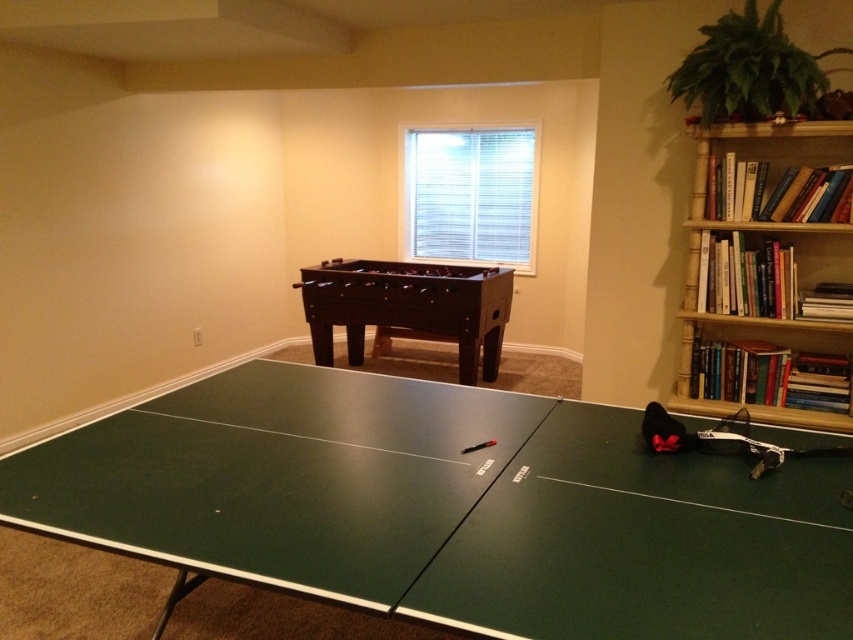
You are organizing a game night and need to move the green matte ping pong table at center closer to the entrance. However, the dark brown wooden foosball table at center is in the way. Can you move the ping pong table to the left without moving the foosball table?

The green matte ping pong table at center is positioned on the right side of the dark brown wooden foosball table at center. Therefore, moving it to the left would require moving it towards the foosball table, which is already blocking that direction. This makes it impossible to move the ping pong table to the left without moving the foosball table.

From the picture: You are organizing a game night and need to move a 7.5 feet long banner between the green matte ping pong table at center and the dark brown wooden foosball table at center. Can the banner fit between them without bending?

The distance between the green matte ping pong table at center and the dark brown wooden foosball table at center is 8.17 feet. Since the banner is 7.5 feet long, it can fit between them without bending as there is enough space.

You are standing at the entrance of the recreational space and want to quickly locate the green matte ping pong table at center. Based on the coordinates provided, where would you look relative to the room?

The green matte ping pong table at center is located at coordinates point 0.795 on the x axis and 0.528 on the y axis, which means it is positioned towards the right side of the room horizontally and in the middle vertically.